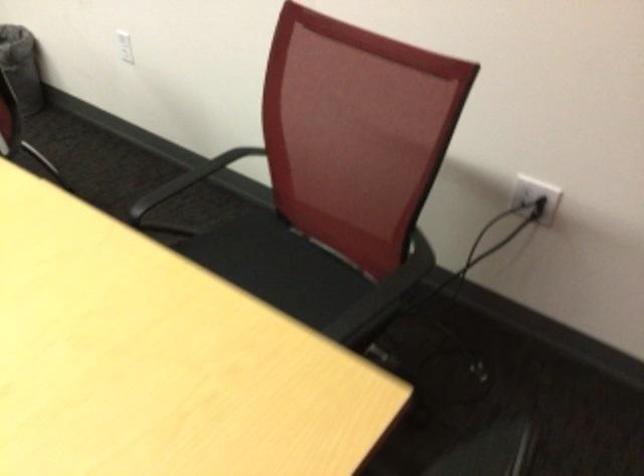
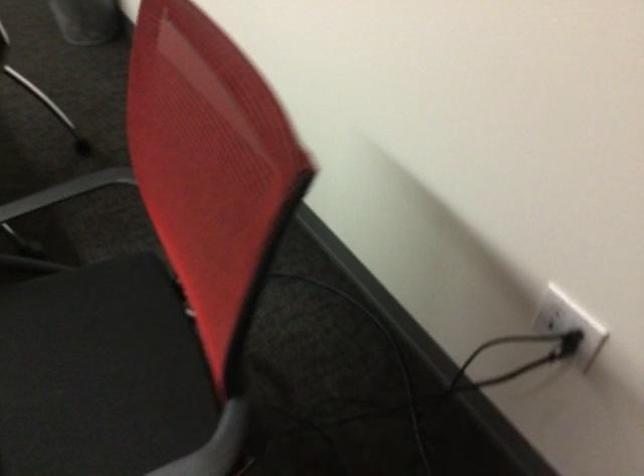
Where in the second image is the point corresponding to point 529,198 from the first image?

(554, 312)